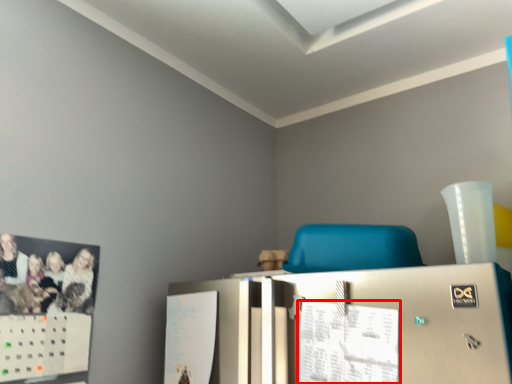
Question: From the image, what is the correct spatial relationship of paper (annotated by the red box) in relation to furniture?

Choices:
 (A) left
 (B) right

Answer: (A)